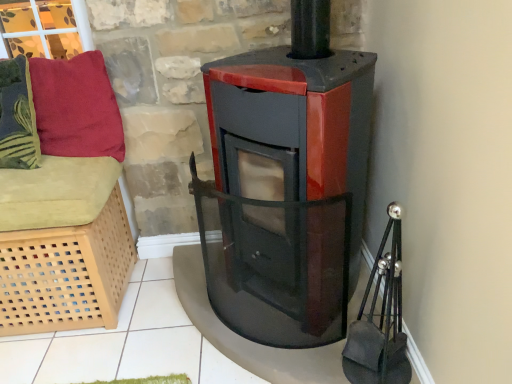
Locate an element on the screen. vacant space to the right of light wood lattice basket at left is located at coordinates (157, 321).